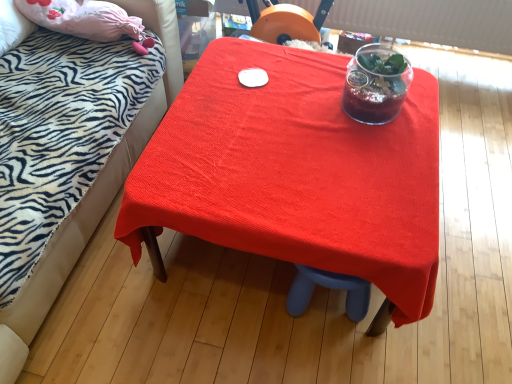
The height and width of the screenshot is (384, 512). Find the location of `translucent glass vase at upper center`. translucent glass vase at upper center is located at coordinates (376, 84).

Locate an element on the screen. This screenshot has height=384, width=512. smooth red tablecloth at center is located at coordinates (296, 173).

How distant is smooth red tablecloth at center from translucent glass vase at upper center?

12.25 inches.

Is smooth red tablecloth at center wider than translucent glass vase at upper center?

Yes, smooth red tablecloth at center is wider than translucent glass vase at upper center.

From a real-world perspective, is smooth red tablecloth at center positioned over translucent glass vase at upper center based on gravity?

No, from a real-world perspective, smooth red tablecloth at center is not on top of translucent glass vase at upper center.

Is point (386, 200) closer or farther from the camera than point (387, 96)?

Clearly, point (386, 200) is closer to the camera than point (387, 96).

Could you tell me if translucent glass vase at upper center is facing smooth red tablecloth at center?

No.

Is translucent glass vase at upper center directly adjacent to smooth red tablecloth at center?

No, translucent glass vase at upper center is not beside smooth red tablecloth at center.

Is translucent glass vase at upper center wider than smooth red tablecloth at center?

No, translucent glass vase at upper center is not wider than smooth red tablecloth at center.

Is point (377, 66) farther from camera compared to point (279, 175)?

Yes, it is.

Between zebra-patterned fabric bed at upper left and smooth red tablecloth at center, which one has smaller size?

smooth red tablecloth at center is smaller.

Between zebra-patterned fabric bed at upper left and smooth red tablecloth at center, which one has larger width?

zebra-patterned fabric bed at upper left is wider.

How far apart are zebra-patterned fabric bed at upper left and smooth red tablecloth at center?

They are 21.70 inches apart.

Which object is positioned more to the right, zebra-patterned fabric bed at upper left or smooth red tablecloth at center?

smooth red tablecloth at center.

Which object is positioned more to the right, zebra-patterned fabric bed at upper left or translucent glass vase at upper center?

translucent glass vase at upper center.

Find the location of `tableware above the zebra-patterned fabric bed at upper left (from a real-world perspective)`. tableware above the zebra-patterned fabric bed at upper left (from a real-world perspective) is located at coordinates (376, 84).

Looking at this image, which of these two, zebra-patterned fabric bed at upper left or translucent glass vase at upper center, is bigger?

Bigger between the two is zebra-patterned fabric bed at upper left.

What's the angular difference between zebra-patterned fabric bed at upper left and translucent glass vase at upper center's facing directions?

There is a 89.9-degree angle between the facing directions of zebra-patterned fabric bed at upper left and translucent glass vase at upper center.

In order to click on desk located underneath the zebra-patterned fabric bed at upper left (from a real-world perspective) in this screenshot , I will do `click(296, 173)`.

What's the angular difference between smooth red tablecloth at center and zebra-patterned fabric bed at upper left's facing directions?

They differ by 89.9 degrees in their facing directions.

Does smooth red tablecloth at center come behind zebra-patterned fabric bed at upper left?

Yes, smooth red tablecloth at center is behind zebra-patterned fabric bed at upper left.

Is smooth red tablecloth at center not inside zebra-patterned fabric bed at upper left?

That's correct, smooth red tablecloth at center is outside of zebra-patterned fabric bed at upper left.

Is translucent glass vase at upper center not close to zebra-patterned fabric bed at upper left?

No.

Identify the location of tableware on the right of zebra-patterned fabric bed at upper left. (376, 84).

What's the angular difference between translucent glass vase at upper center and zebra-patterned fabric bed at upper left's facing directions?

The angle between the facing direction of translucent glass vase at upper center and the facing direction of zebra-patterned fabric bed at upper left is 89.9 degrees.

This screenshot has width=512, height=384. In order to click on desk in front of the translucent glass vase at upper center in this screenshot , I will do `click(296, 173)`.

Locate an element on the screen. The height and width of the screenshot is (384, 512). desk directly beneath the translucent glass vase at upper center (from a real-world perspective) is located at coordinates (296, 173).

Which object lies further to the anchor point zebra-patterned fabric bed at upper left, smooth red tablecloth at center or translucent glass vase at upper center?

translucent glass vase at upper center lies further to zebra-patterned fabric bed at upper left than the other object.

When comparing their distances from translucent glass vase at upper center, does smooth red tablecloth at center or zebra-patterned fabric bed at upper left seem closer?

smooth red tablecloth at center.

From the image, which object appears to be nearer to smooth red tablecloth at center, zebra-patterned fabric bed at upper left or translucent glass vase at upper center?

The object closer to smooth red tablecloth at center is translucent glass vase at upper center.

Looking at the image, which one is located closer to translucent glass vase at upper center, zebra-patterned fabric bed at upper left or smooth red tablecloth at center?

smooth red tablecloth at center is closer to translucent glass vase at upper center.

Which object lies nearer to the anchor point zebra-patterned fabric bed at upper left, translucent glass vase at upper center or smooth red tablecloth at center?

smooth red tablecloth at center is positioned closer to the anchor zebra-patterned fabric bed at upper left.

Looking at the image, which one is located closer to smooth red tablecloth at center, translucent glass vase at upper center or zebra-patterned fabric bed at upper left?

translucent glass vase at upper center is positioned closer to the anchor smooth red tablecloth at center.

You are a GUI agent. You are given a task and a screenshot of the screen. Output one action in this format:
    pyautogui.click(x=<x>, y=<y>)
    Task: Click on the desk between zebra-patterned fabric bed at upper left and translucent glass vase at upper center from left to right
    
    Given the screenshot: What is the action you would take?
    pyautogui.click(x=296, y=173)